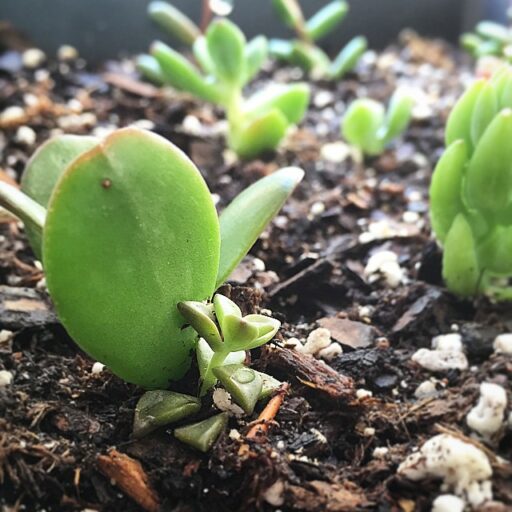
Identify the location of wall. Image resolution: width=512 pixels, height=512 pixels. (110, 14).